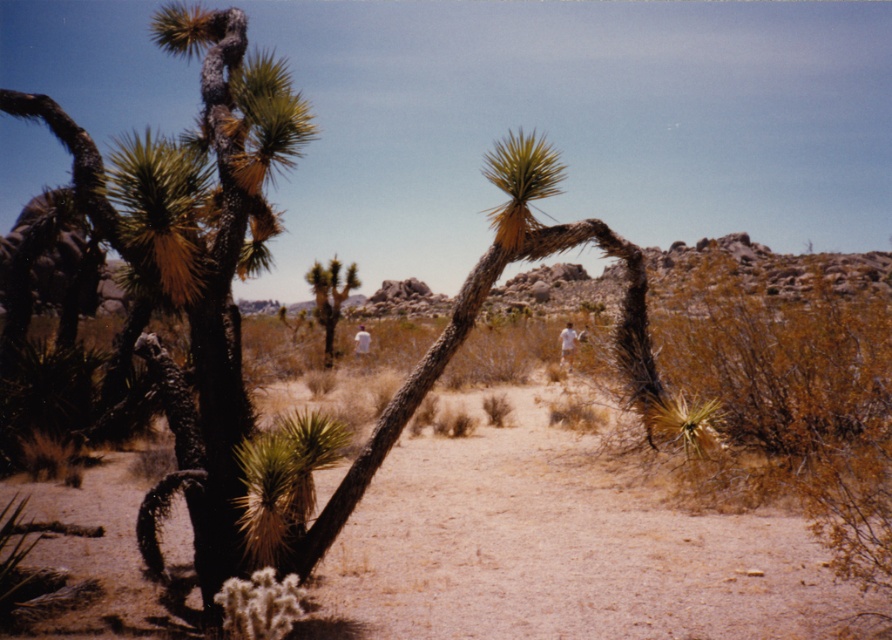
Question: Among these points, which one is nearest to the camera?

Choices:
 (A) (577, 465)
 (B) (332, 276)

Answer: (A)

Question: Can you confirm if brown sandy ground at center is positioned below green spiky cactus at center?

Choices:
 (A) no
 (B) yes

Answer: (B)

Question: Is brown sandy ground at center to the left of green spiky cactus at center from the viewer's perspective?

Choices:
 (A) yes
 (B) no

Answer: (B)

Question: Among these objects, which one is farthest from the camera?

Choices:
 (A) brown sandy ground at center
 (B) green spiky cactus at center

Answer: (B)

Question: Considering the relative positions of brown sandy ground at center and green spiky cactus at center in the image provided, where is brown sandy ground at center located with respect to green spiky cactus at center?

Choices:
 (A) right
 (B) left

Answer: (A)